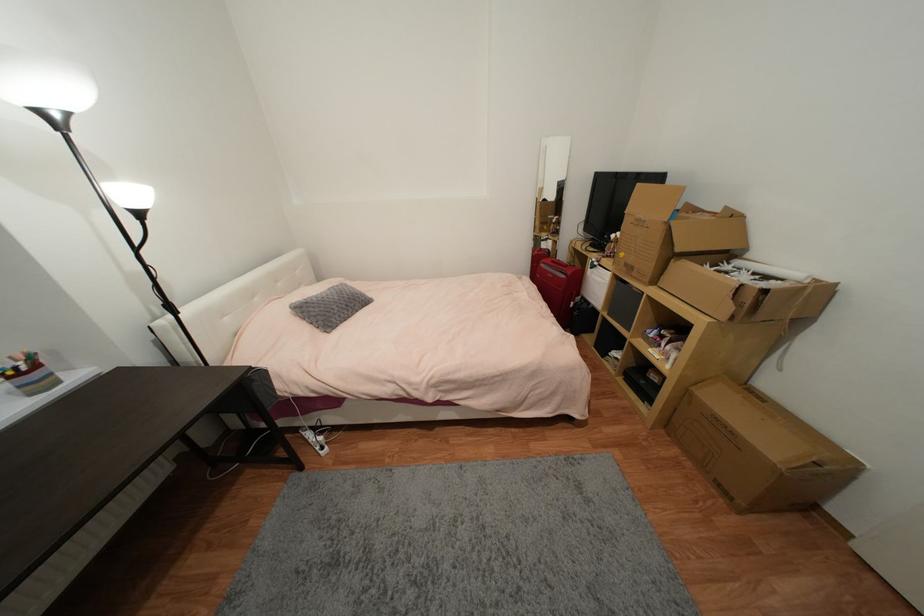
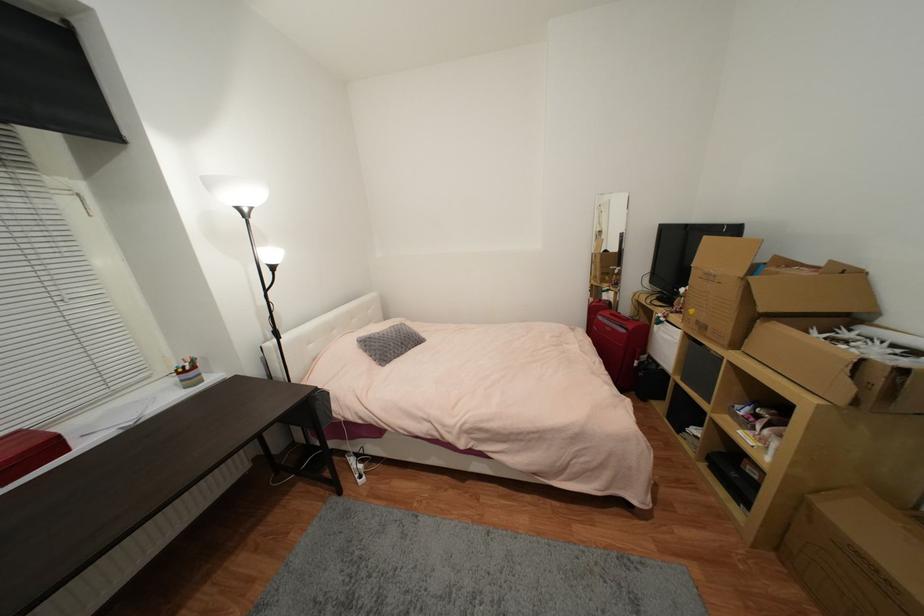
The point at (588, 300) is marked in the first image. Where is the corresponding point in the second image?

(653, 359)